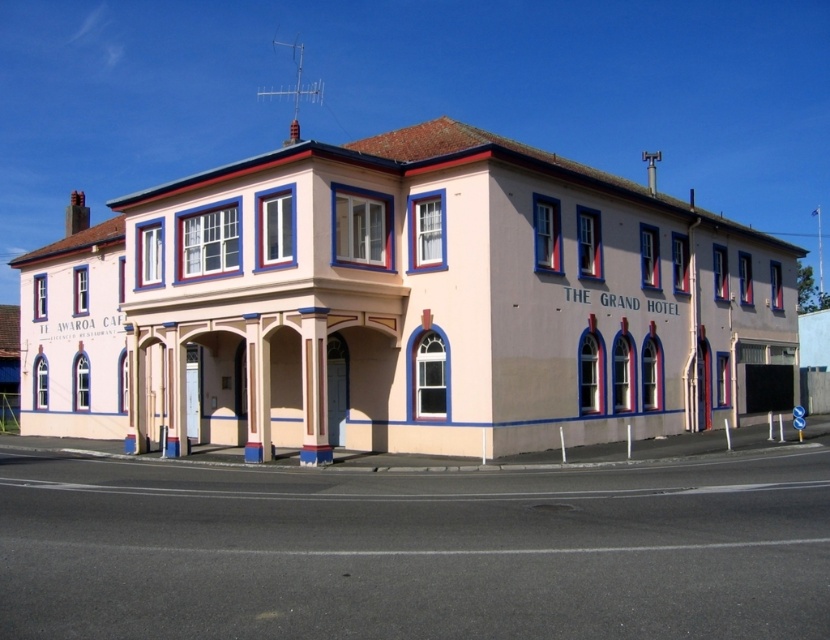
You are standing in front of THE GRAND HOTEL and notice the blue painted wood trim at upper center. Where exactly is this trim located in terms of coordinates?

The blue painted wood trim at upper center is located at point (x=445, y=300).